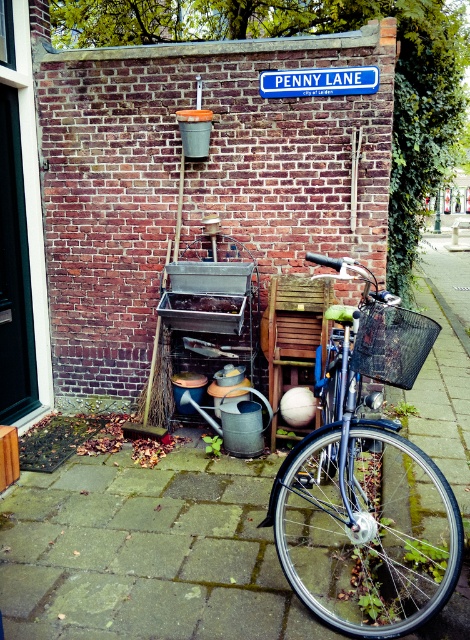
You are a delivery person trying to park your 16.5 inch wide cart between the smooth concrete pavement at lower center and the shiny metallic bicycle at center. Can your cart fit in that space?

The space between the smooth concrete pavement at lower center and the shiny metallic bicycle at center is 14.90 inches. Since your cart is 16.5 inches wide, it cannot fit in the space.

You are a delivery person trying to park your shiny metallic bicycle at center near the smooth concrete pavement at lower center. Can the bicycle fit entirely on the pavement?

The smooth concrete pavement at lower center is wider than the shiny metallic bicycle at center, so the bicycle can fit entirely on the pavement.